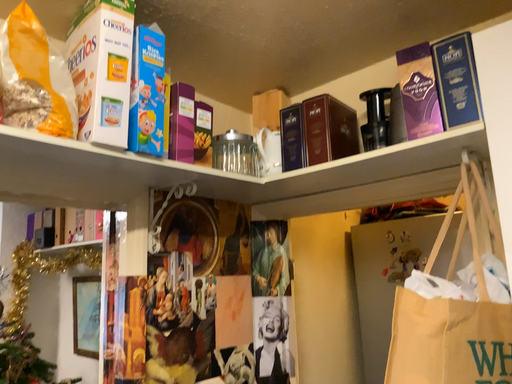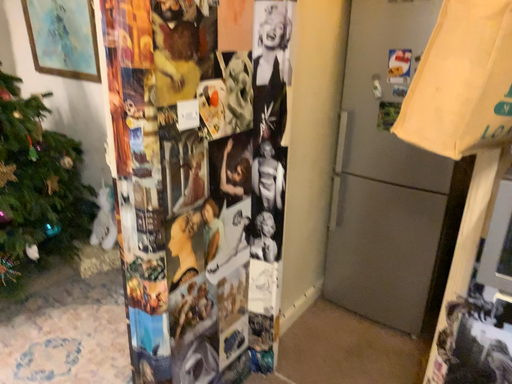
Question: How did the camera likely rotate when shooting the video?

Choices:
 (A) rotated downward
 (B) rotated upward

Answer: (A)